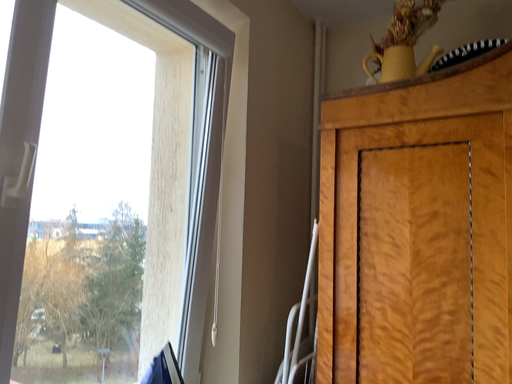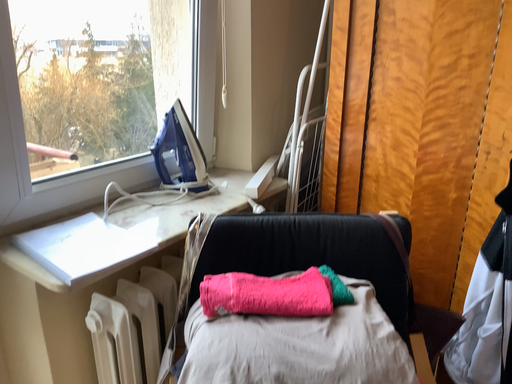
Question: Which way did the camera rotate in the video?

Choices:
 (A) rotated downward
 (B) rotated upward

Answer: (A)